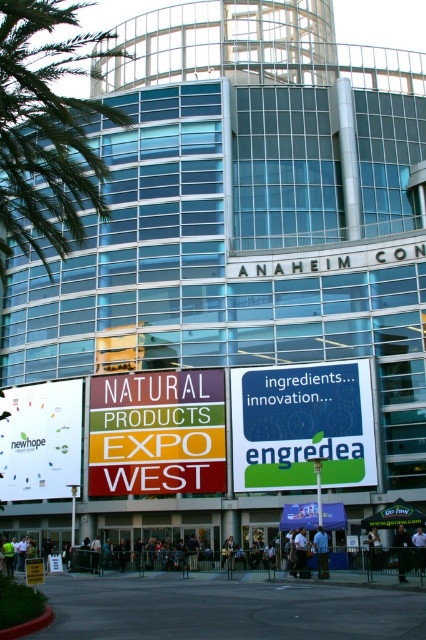
Question: Does green leafy palm tree at upper left appear on the left side of blue-green plastic signboard at center?

Choices:
 (A) yes
 (B) no

Answer: (A)

Question: Is green leafy palm tree at upper left closer to the viewer compared to green matte signboard at center?

Choices:
 (A) yes
 (B) no

Answer: (A)

Question: Can you confirm if white paper billboard at lower left is bigger than green matte signboard at center?

Choices:
 (A) yes
 (B) no

Answer: (A)

Question: Estimate the real-world distances between objects in this image. Which object is closer to the dark blue shirt at lower center?

Choices:
 (A) dark blue shirt at center
 (B) dark blue jeans at lower center
 (C) white paper billboard at lower left
 (D) blue fabric shirt at center

Answer: (D)

Question: Among these objects, which one is nearest to the camera?

Choices:
 (A) blue fabric shirt at center
 (B) dark blue shirt at center
 (C) dark blue shirt at lower center

Answer: (C)

Question: Among these points, which one is nearest to the camera?

Choices:
 (A) (302, 540)
 (B) (405, 550)

Answer: (B)